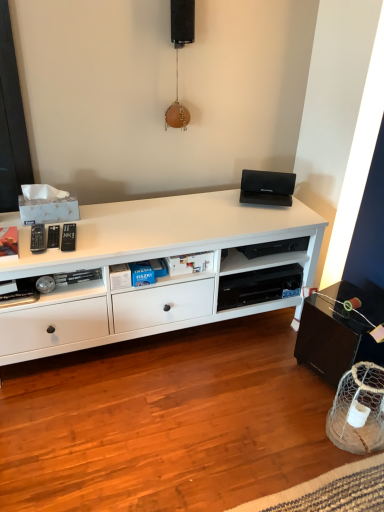
Describe the element at coordinates (158, 280) in the screenshot. This screenshot has width=384, height=512. I see `white matte cabinet at center` at that location.

In order to face black matte speaker at upper center, should I rotate leftwards or rightwards?

It's best to rotate left around 1.708 degrees.

In order to click on black plastic shelf at center in this screenshot , I will do `click(257, 286)`.

Where is `white matte cabinet at center`? The width and height of the screenshot is (384, 512). white matte cabinet at center is located at coordinates (x=158, y=280).

From the image's perspective, which object appears higher, black plastic shelf at center or black matte speaker at upper center?

black matte speaker at upper center appears higher in the image.

Could you tell me if black plastic shelf at center is facing black matte speaker at upper center?

No, black plastic shelf at center is not aimed at black matte speaker at upper center.

Is black plastic shelf at center bigger than black matte speaker at upper center?

Correct, black plastic shelf at center is larger in size than black matte speaker at upper center.

Is black plastic shelf at center completely or partially outside of black matte speaker at upper center?

Absolutely, black plastic shelf at center is external to black matte speaker at upper center.

From a real-world perspective, which is physically below, white matte cabinet at center or black matte speaker at upper center?

white matte cabinet at center, from a real-world perspective.

Considering the positions of objects white matte cabinet at center and black matte speaker at upper center in the image provided, who is more to the right, white matte cabinet at center or black matte speaker at upper center?

black matte speaker at upper center.

Does white matte cabinet at center come behind black matte speaker at upper center?

No, the depth of white matte cabinet at center is less than that of black matte speaker at upper center.

Can you confirm if white matte cabinet at center is thinner than black matte speaker at upper center?

Incorrect, the width of white matte cabinet at center is not less than that of black matte speaker at upper center.

From a real-world perspective, is black matte speaker at upper center positioned above or below black plastic shelf at center?

In terms of real-world spatial position, black matte speaker at upper center is above black plastic shelf at center.

Is black matte speaker at upper center bigger or smaller than black plastic shelf at center?

black matte speaker at upper center is smaller than black plastic shelf at center.

Which object is thinner, black matte speaker at upper center or black plastic shelf at center?

Thinner between the two is black matte speaker at upper center.

Is black plastic shelf at center located within black matte speaker at upper center?

No.

Considering the relative sizes of white matte cabinet at center and black plastic shelf at center in the image provided, is white matte cabinet at center wider than black plastic shelf at center?

Yes.

Considering the relative sizes of white matte cabinet at center and black plastic shelf at center in the image provided, is white matte cabinet at center smaller than black plastic shelf at center?

No.

From the picture: How many degrees apart are the facing directions of white matte cabinet at center and black plastic shelf at center?

They differ by 1.1 degrees in their facing directions.

Are white matte cabinet at center and black plastic shelf at center far apart?

No, white matte cabinet at center is in close proximity to black plastic shelf at center.

Does black plastic shelf at center lie behind white matte cabinet at center?

Yes, black plastic shelf at center is behind white matte cabinet at center.

The image size is (384, 512). Identify the location of desk that appears in front of the black plastic shelf at center. (158, 280).

From the image's perspective, is black plastic shelf at center below white matte cabinet at center?

Yes.

From a real-world perspective, is black plastic shelf at center positioned above or below white matte cabinet at center?

In terms of real-world spatial position, black plastic shelf at center is below white matte cabinet at center.

In the image, is black matte speaker at upper center positioned in front of or behind white matte cabinet at center?

In the image, black matte speaker at upper center appears behind white matte cabinet at center.

Does black matte speaker at upper center have a larger size compared to white matte cabinet at center?

No.

Is black matte speaker at upper center aimed at white matte cabinet at center?

No, black matte speaker at upper center does not turn towards white matte cabinet at center.

Where is `shelf lying below the black matte speaker at upper center (from the image's perspective)`? Image resolution: width=384 pixels, height=512 pixels. shelf lying below the black matte speaker at upper center (from the image's perspective) is located at coordinates (257, 286).

Where is `speaker positioned vertically above the white matte cabinet at center (from a real-world perspective)`? This screenshot has width=384, height=512. speaker positioned vertically above the white matte cabinet at center (from a real-world perspective) is located at coordinates 182,22.

When comparing their distances from black plastic shelf at center, does black matte speaker at upper center or white matte cabinet at center seem closer?

Among the two, white matte cabinet at center is located nearer to black plastic shelf at center.

Estimate the real-world distances between objects in this image. Which object is further from black matte speaker at upper center, black plastic shelf at center or white matte cabinet at center?

Based on the image, black plastic shelf at center appears to be further to black matte speaker at upper center.

When comparing their distances from black matte speaker at upper center, does white matte cabinet at center or black plastic shelf at center seem further?

Based on the image, black plastic shelf at center appears to be further to black matte speaker at upper center.

Which object lies nearer to the anchor point white matte cabinet at center, black matte speaker at upper center or black plastic shelf at center?

black plastic shelf at center lies closer to white matte cabinet at center than the other object.

Looking at the image, which one is located closer to white matte cabinet at center, black plastic shelf at center or black matte speaker at upper center?

Among the two, black plastic shelf at center is located nearer to white matte cabinet at center.

From the image, which object appears to be nearer to black plastic shelf at center, white matte cabinet at center or black matte speaker at upper center?

white matte cabinet at center lies closer to black plastic shelf at center than the other object.

Locate an element on the screen. desk that lies between black matte speaker at upper center and black plastic shelf at center from top to bottom is located at coordinates (158, 280).